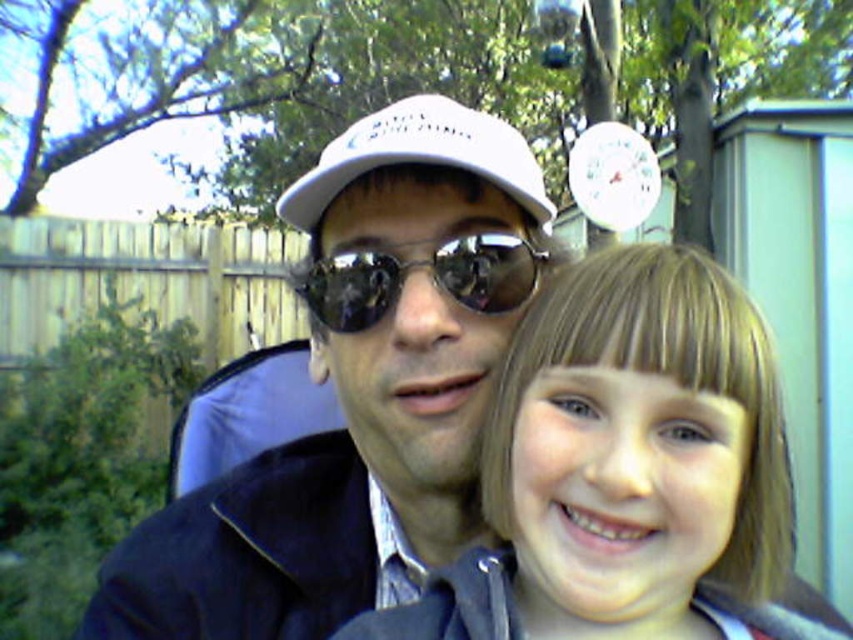
Question: Which of these objects is positioned closest to the shiny reflective sunglasses at center?

Choices:
 (A) matte white cap at center
 (B) smooth blonde hair at center

Answer: (A)

Question: From the image, what is the correct spatial relationship of smooth blonde hair at center in relation to white matte baseball cap at center?

Choices:
 (A) right
 (B) left

Answer: (A)

Question: Is matte white cap at center smaller than shiny reflective sunglasses at center?

Choices:
 (A) yes
 (B) no

Answer: (B)

Question: Among these points, which one is nearest to the camera?

Choices:
 (A) (302, 531)
 (B) (514, 266)

Answer: (B)

Question: Can you confirm if smooth blonde hair at center is positioned to the left of shiny reflective sunglasses at center?

Choices:
 (A) no
 (B) yes

Answer: (A)

Question: Which point is farther from the camera taking this photo?

Choices:
 (A) (456, 154)
 (B) (415, 449)
 (C) (524, 284)
 (D) (688, 291)

Answer: (C)